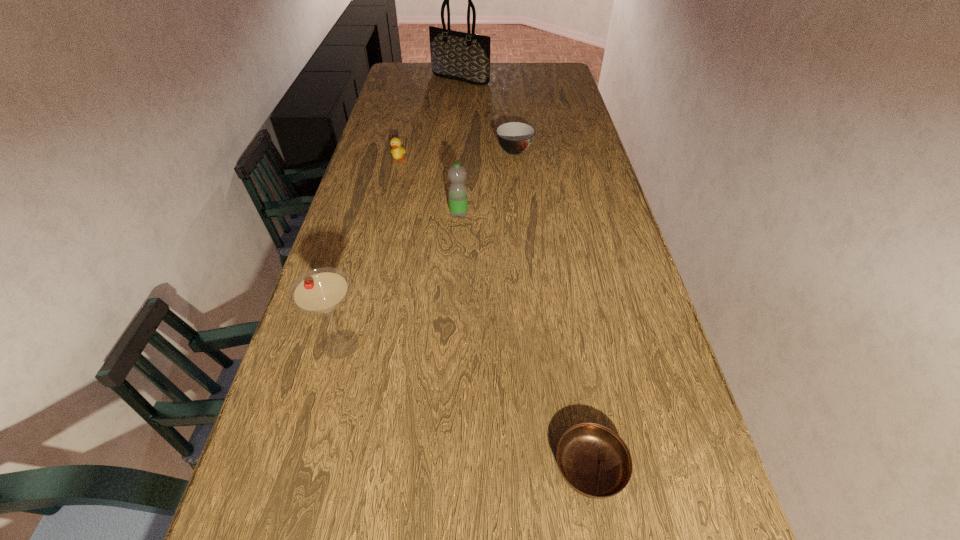
Where is `tote bag`? Image resolution: width=960 pixels, height=540 pixels. tote bag is located at coordinates (456, 55).

The width and height of the screenshot is (960, 540). In order to click on the farthest object in this screenshot , I will do `click(456, 55)`.

This screenshot has width=960, height=540. I want to click on martini, so click(x=320, y=291).

Identify the location of water bottle. The height and width of the screenshot is (540, 960). (458, 202).

Image resolution: width=960 pixels, height=540 pixels. In order to click on duckling in this screenshot , I will do `click(397, 151)`.

Image resolution: width=960 pixels, height=540 pixels. Identify the location of the second shortest object. (514, 137).

Identify the location of the taller soup bowl. This screenshot has height=540, width=960. (514, 137).

Where is `the shortest object`? the shortest object is located at coordinates (594, 461).

Where is `the nearest object`? The image size is (960, 540). the nearest object is located at coordinates (594, 461).

Where is `vacant space situated 0.100m on the right of the farthest object`? Image resolution: width=960 pixels, height=540 pixels. vacant space situated 0.100m on the right of the farthest object is located at coordinates (511, 79).